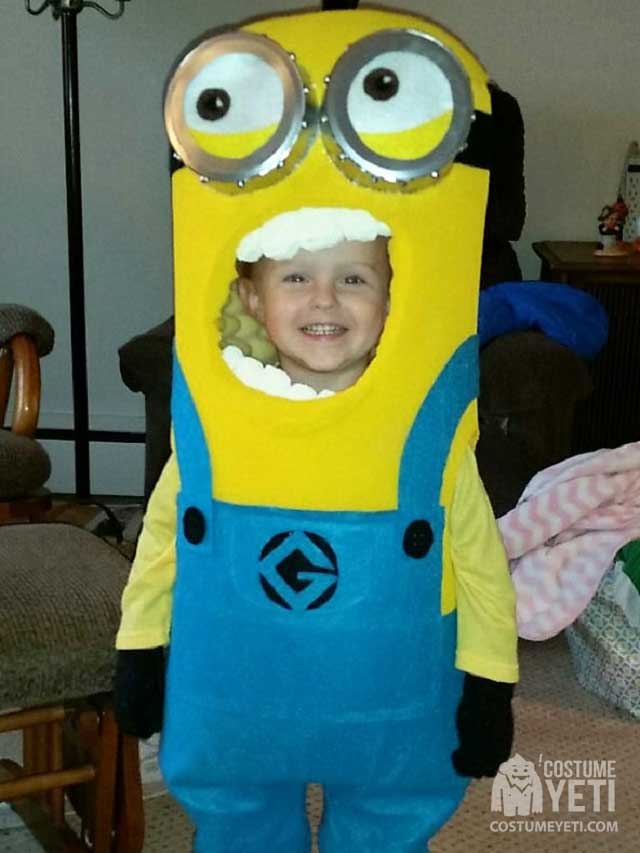
The height and width of the screenshot is (853, 640). I want to click on white wall, so click(x=115, y=78).